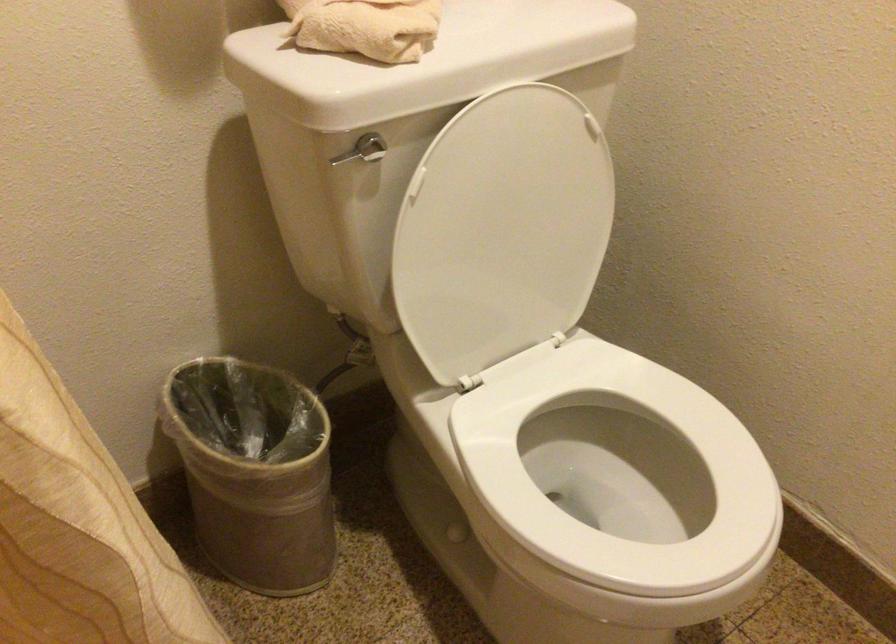
At what (x,y) coordinates should I click in order to perform the action: click on toilet flush handle. Please return your answer as a coordinate pair (x, y). This screenshot has height=644, width=896. Looking at the image, I should click on (348, 155).